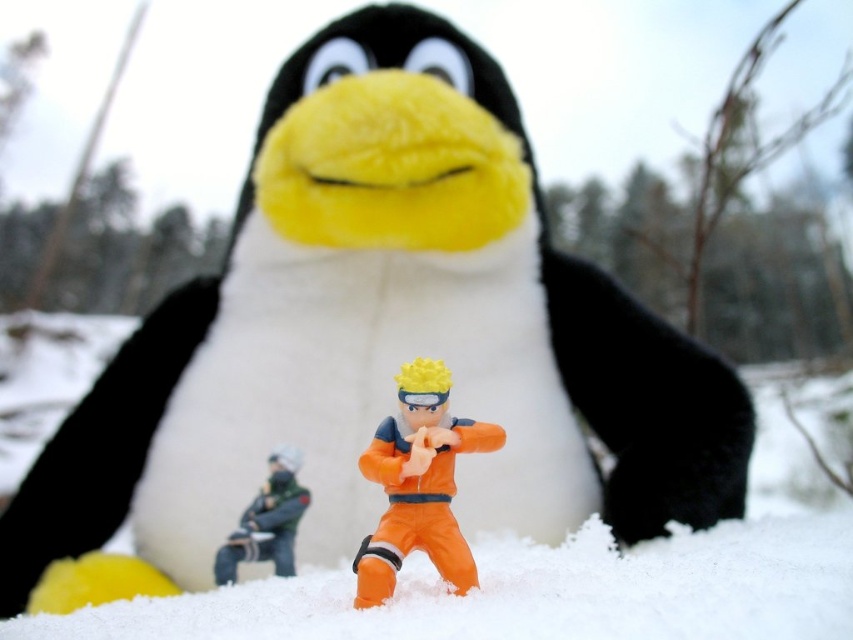
Question: Can you confirm if white fluffy snow at center is thinner than orange matte toy at center?

Choices:
 (A) no
 (B) yes

Answer: (A)

Question: Based on their relative distances, which object is farther from the orange plastic toy at center?

Choices:
 (A) white fluffy snow at center
 (B) orange matte toy at center

Answer: (B)

Question: Does orange matte toy at center appear over orange plastic toy at center?

Choices:
 (A) yes
 (B) no

Answer: (A)

Question: Which object is the farthest from the white fluffy snow at center?

Choices:
 (A) orange plastic toy at center
 (B) orange matte toy at center

Answer: (A)

Question: Which of these objects is positioned closest to the white fluffy snow at center?

Choices:
 (A) orange plastic toy at center
 (B) orange matte toy at center

Answer: (B)

Question: Can you confirm if white fluffy snow at center is wider than orange plastic toy at center?

Choices:
 (A) yes
 (B) no

Answer: (A)